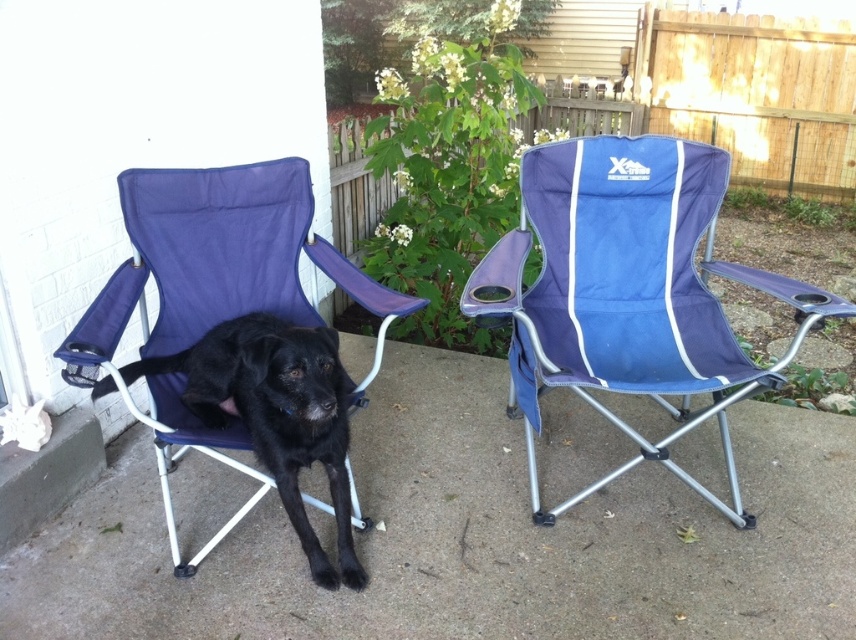
Question: Which point is farther to the camera?

Choices:
 (A) blue fabric folding chair at center
 (B) navy blue fabric chair at left
 (C) black matte dog at left

Answer: (A)

Question: Is blue fabric folding chair at center to the right of navy blue fabric chair at left from the viewer's perspective?

Choices:
 (A) yes
 (B) no

Answer: (A)

Question: Can you confirm if navy blue fabric chair at left is wider than black matte dog at left?

Choices:
 (A) no
 (B) yes

Answer: (B)

Question: Can you confirm if blue fabric folding chair at center is thinner than black matte dog at left?

Choices:
 (A) no
 (B) yes

Answer: (A)

Question: Which point is farther to the camera?

Choices:
 (A) (358, 403)
 (B) (218, 332)
 (C) (599, 481)

Answer: (C)

Question: Estimate the real-world distances between objects in this image. Which object is farther from the black matte dog at left?

Choices:
 (A) blue fabric folding chair at center
 (B) navy blue fabric chair at left

Answer: (A)